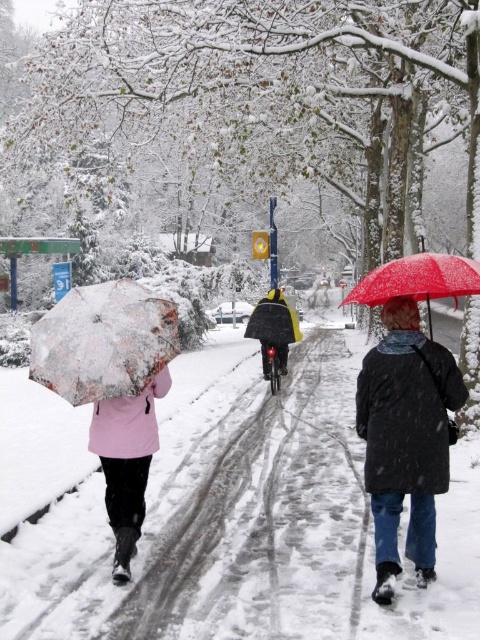
Question: Is matte pink coat at left wider than red matte umbrella at right?

Choices:
 (A) yes
 (B) no

Answer: (B)

Question: Can you confirm if translucent snow-covered umbrella at left is bigger than red matte umbrella at right?

Choices:
 (A) no
 (B) yes

Answer: (A)

Question: Which of the following is the farthest from the observer?

Choices:
 (A) (106, 461)
 (B) (286, 424)
 (C) (78, 360)

Answer: (B)

Question: Based on their relative distances, which object is nearer to the matte pink coat at left?

Choices:
 (A) black matte coat at center
 (B) red matte umbrella at right
 (C) white snow-covered pavement at center
 (D) translucent snow-covered umbrella at left

Answer: (D)

Question: Which object is farther from the camera taking this photo?

Choices:
 (A) translucent snow-covered umbrella at left
 (B) white snow-covered pavement at center
 (C) red matte umbrella at right

Answer: (A)

Question: Can you confirm if white snow-covered pavement at center is positioned to the right of matte pink coat at left?

Choices:
 (A) yes
 (B) no

Answer: (B)